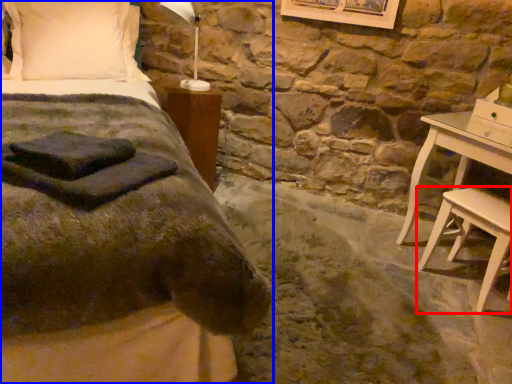
Question: Among these objects, which one is farthest to the camera, stool (highlighted by a red box) or bed (highlighted by a blue box)?

Choices:
 (A) stool
 (B) bed

Answer: (A)